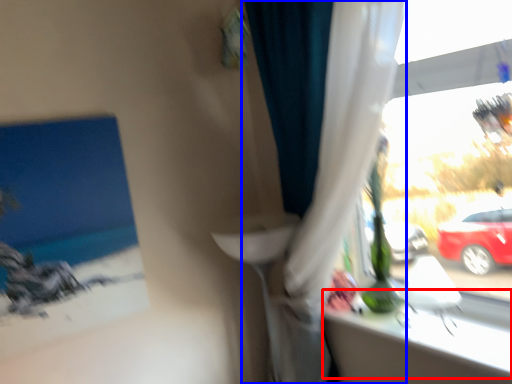
Question: Among these objects, which one is nearest to the camera, window sill (highlighted by a red box) or curtain (highlighted by a blue box)?

Choices:
 (A) window sill
 (B) curtain

Answer: (B)